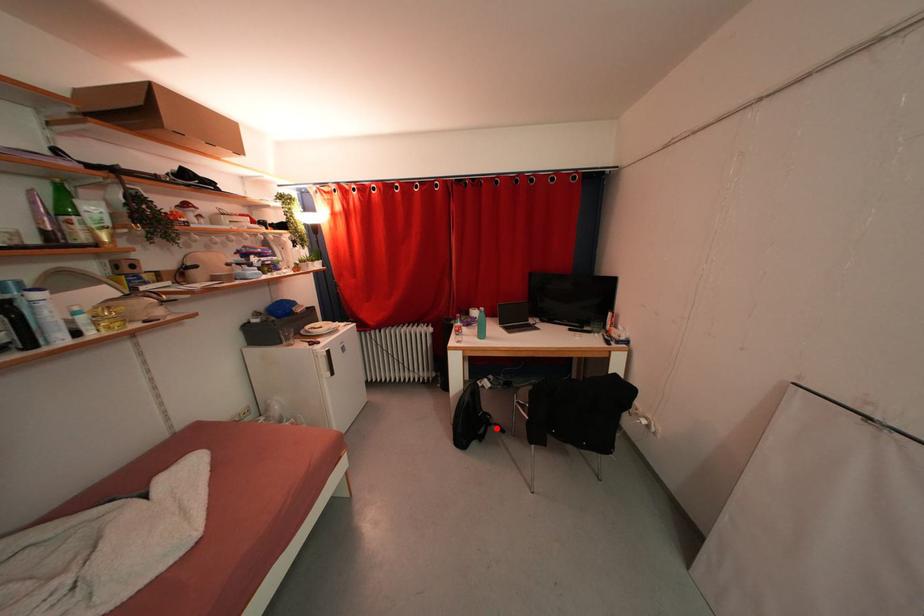
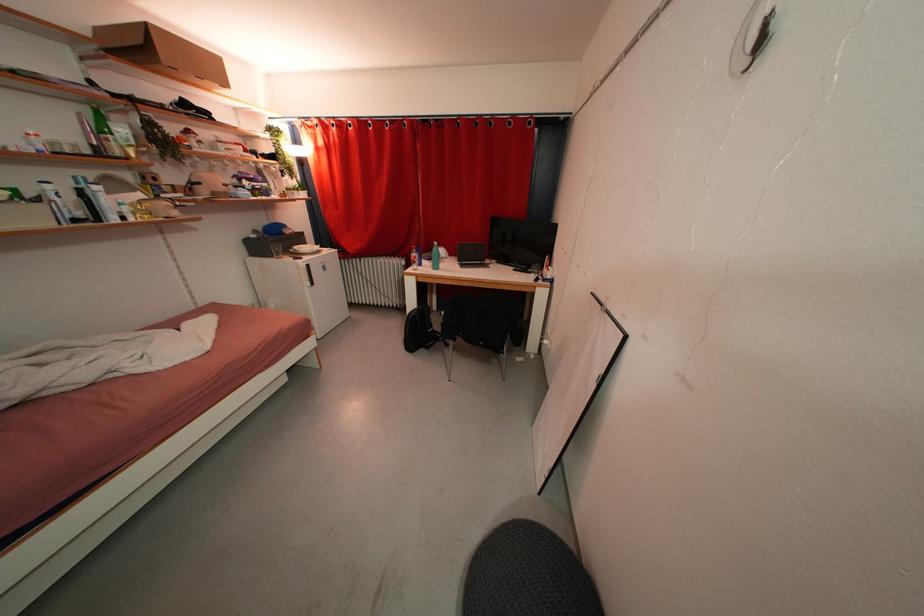
Question: I am providing you with two images of the same scene from different viewpoints. Image1 has a red point marked. In image2, the corresponding 3D location appears at what relative position? Reply with the corresponding letter.

Choices:
 (A) Closer
 (B) Farther

Answer: (B)